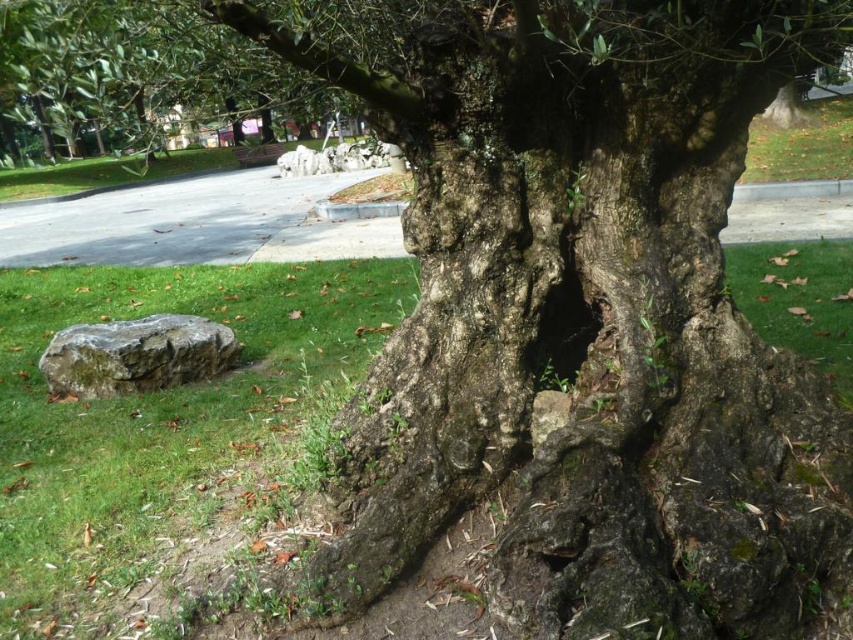
You are a gardener trying to plant a new shrub. You have two options for placement near the tree trunk. The first option is next to the green mossy rock at lower left, and the second is near the dark rough hole at center. Which location is lower in elevation?

The green mossy rock at lower left is below the dark rough hole at center, so the location next to the green mossy rock at lower left is lower in elevation.

You are standing in front of a large tree trunk and want to touch two specific points on it. The first point is at coordinates point (73, 636) and the second is at point (550, 312). Which point will you reach first if you move towards the trunk?

Point (73, 636) is closer to the camera than point (550, 312), so you will reach point (73, 636) first.

You are standing in front of the large tree trunk and want to place a small decoration between the two points, point (386, 307) and point (177, 314). Which point is closer to you so that you can place the decoration there?

Point (386, 307) is further to the viewer than point (177, 314), so the point closer to you is point (177, 314). You should place the decoration near that point.